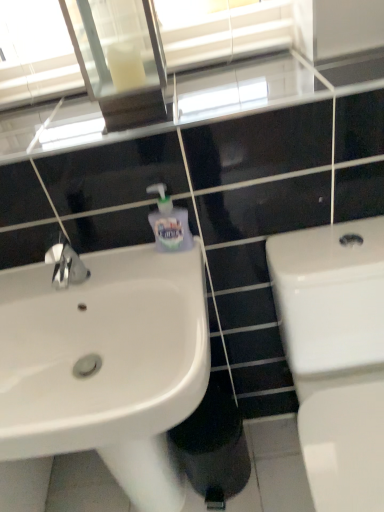
Find the location of a particular element. Image resolution: width=384 pixels, height=512 pixels. vacant position to the left of clear glass mirror at upper center is located at coordinates (48, 117).